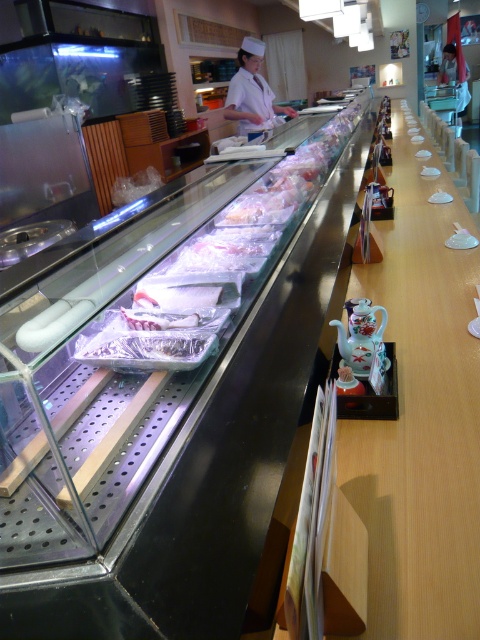
Question: Observing the image, what is the correct spatial positioning of white uniform at center in reference to porcelain teapot at center?

Choices:
 (A) below
 (B) above

Answer: (B)

Question: Among these points, which one is nearest to the camera?

Choices:
 (A) (342, 362)
 (B) (249, 49)

Answer: (A)

Question: Is white uniform at center smaller than porcelain teapot at center?

Choices:
 (A) yes
 (B) no

Answer: (B)

Question: Is white uniform at center to the right of porcelain teapot at center from the viewer's perspective?

Choices:
 (A) yes
 (B) no

Answer: (B)